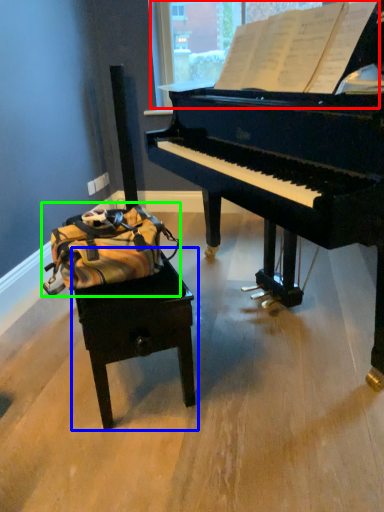
Question: Considering the real-world distances, which object is farthest from window screen (highlighted by a red box)? table (highlighted by a blue box) or messenger bag (highlighted by a green box)?

Choices:
 (A) table
 (B) messenger bag

Answer: (A)